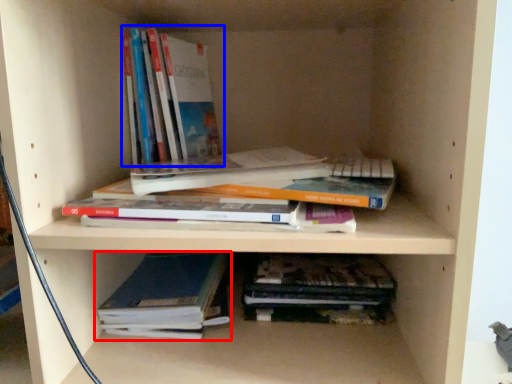
Question: Which of the following is the closest to the observer, book (highlighted by a red box) or book (highlighted by a blue box)?

Choices:
 (A) book
 (B) book

Answer: (A)